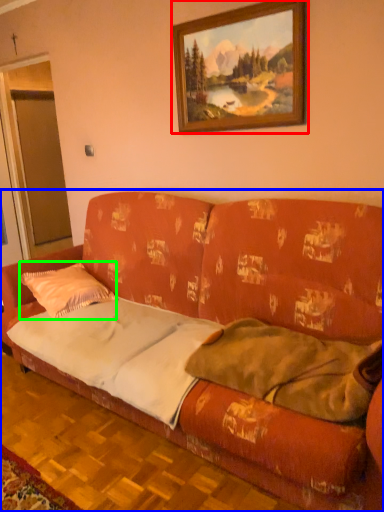
Question: Which is farther away from picture frame (highlighted by a red box)? studio couch (highlighted by a blue box) or throw pillow (highlighted by a green box)?

Choices:
 (A) studio couch
 (B) throw pillow

Answer: (B)